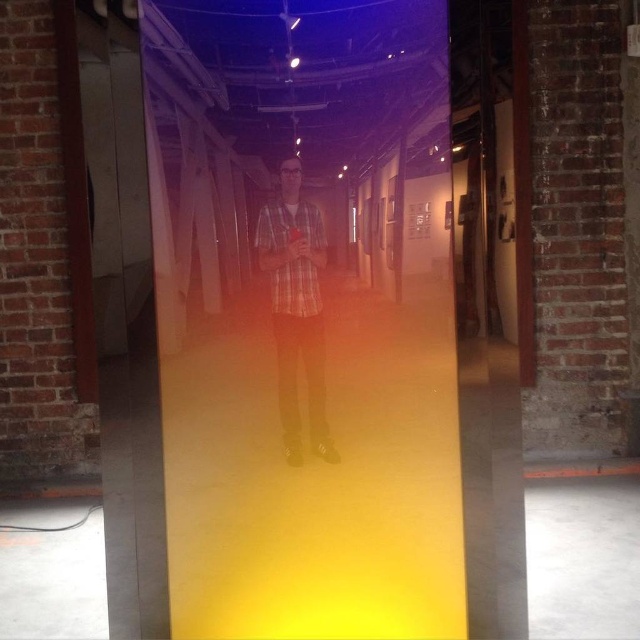
Who is higher up, transparent glass door at center or plaid shirt at center?

plaid shirt at center is above.

Identify the location of transparent glass door at center. The image size is (640, 640). (305, 316).